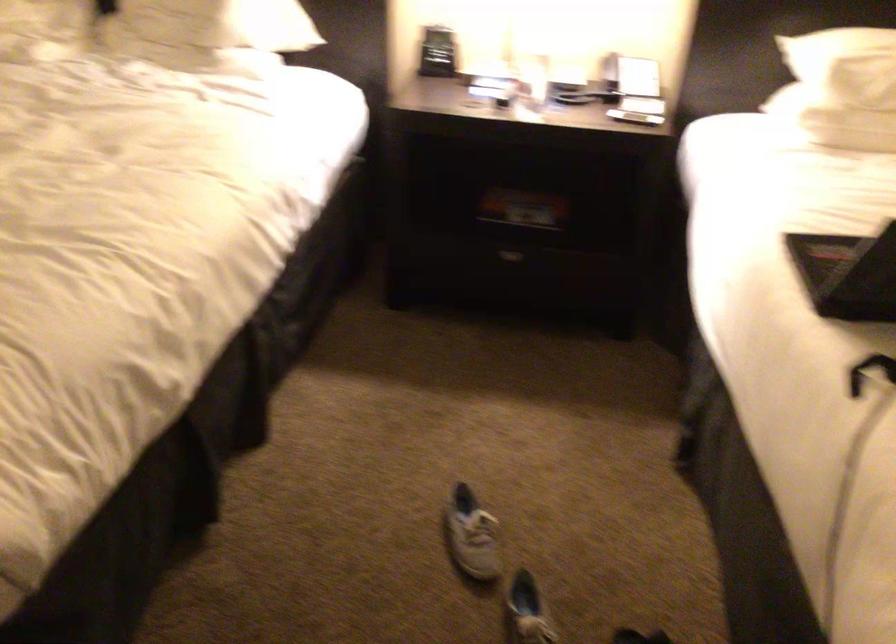
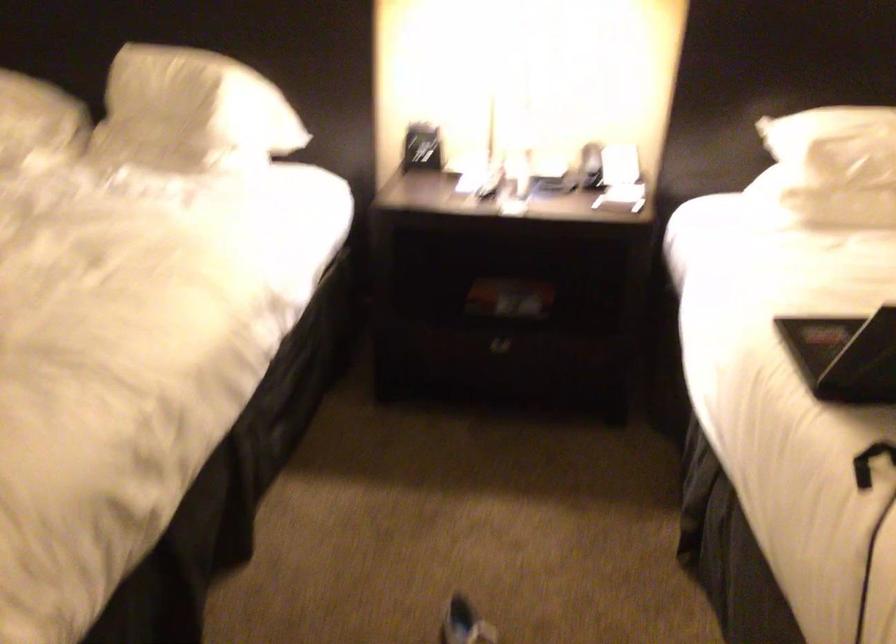
Where in the second image is the point corresponding to [627,87] from the first image?

(609, 176)